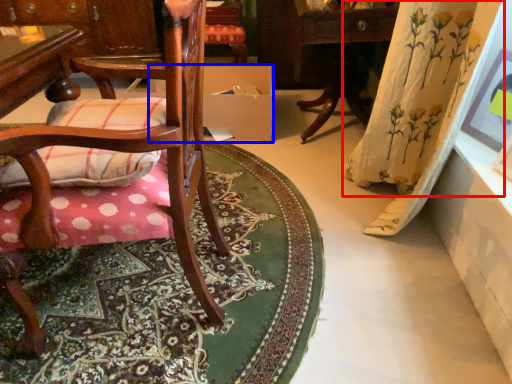
Question: Which of the following is the closest to the observer, curtain (highlighted by a red box) or cardboard box (highlighted by a blue box)?

Choices:
 (A) curtain
 (B) cardboard box

Answer: (A)